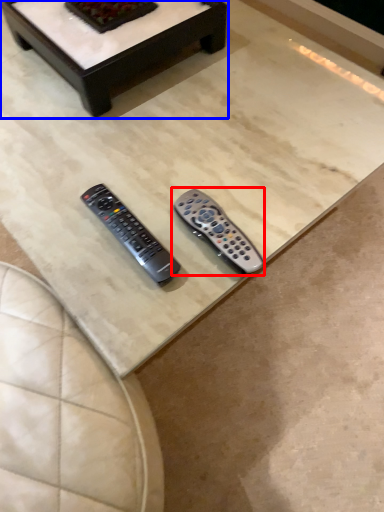
Question: Among these objects, which one is farthest to the camera, remote control (highlighted by a red box) or coffee table (highlighted by a blue box)?

Choices:
 (A) remote control
 (B) coffee table

Answer: (B)